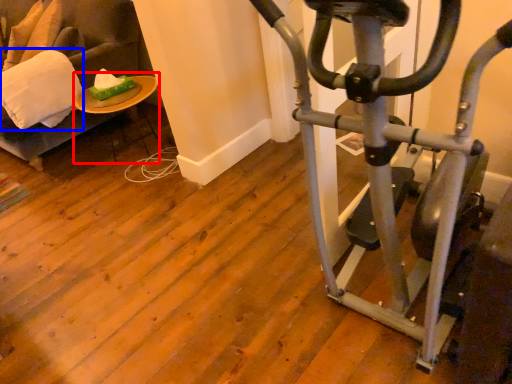
Question: Which point is closer to the camera, table (highlighted by a red box) or pillow (highlighted by a blue box)?

Choices:
 (A) table
 (B) pillow

Answer: (B)